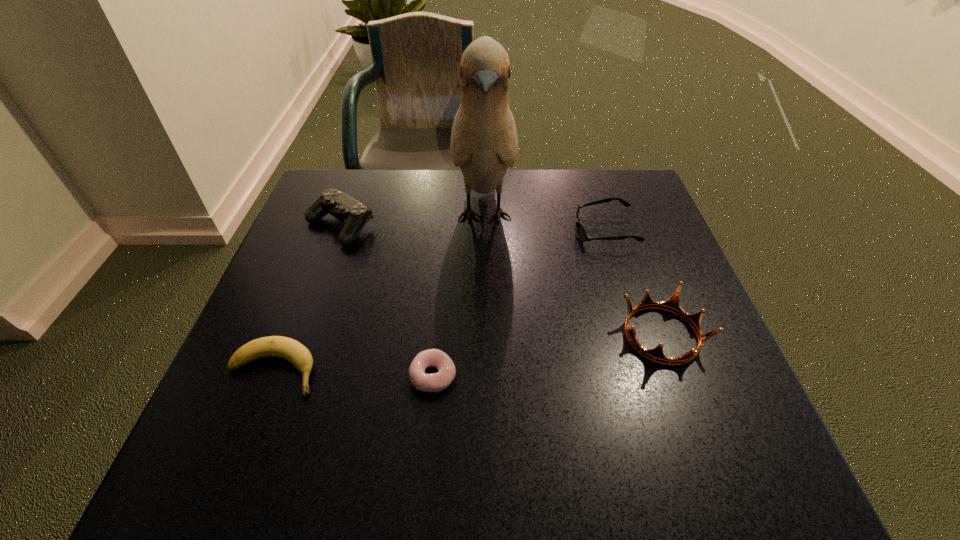
The image size is (960, 540). In order to click on unoccupied area between the banana and the crown in this screenshot , I will do `click(468, 353)`.

Locate an element on the screen. The image size is (960, 540). blank region between the control and the banana is located at coordinates (306, 299).

Find the location of a particular element. Image resolution: width=960 pixels, height=540 pixels. vacant space that's between the control and the tallest object is located at coordinates (412, 221).

The image size is (960, 540). What are the coordinates of `free space between the crown and the tallest object` in the screenshot? It's located at (573, 275).

Where is `free point between the tallest object and the crown`? This screenshot has width=960, height=540. free point between the tallest object and the crown is located at coordinates (573, 275).

Where is `free space between the doughnut and the crown`? This screenshot has width=960, height=540. free space between the doughnut and the crown is located at coordinates (547, 355).

You are a GUI agent. You are given a task and a screenshot of the screen. Output one action in this format:
    pyautogui.click(x=<x>, y=<y>)
    Task: Click on the free space between the doughnut and the sunglasses
    
    Given the screenshot: What is the action you would take?
    pyautogui.click(x=518, y=303)

Locate an element on the screen. This screenshot has height=540, width=960. free space between the tallest object and the third shortest object is located at coordinates (544, 224).

Identify the location of free space between the control and the banana. (306, 299).

Identify the location of unoccupied position between the doughnut and the crown. This screenshot has height=540, width=960. (547, 355).